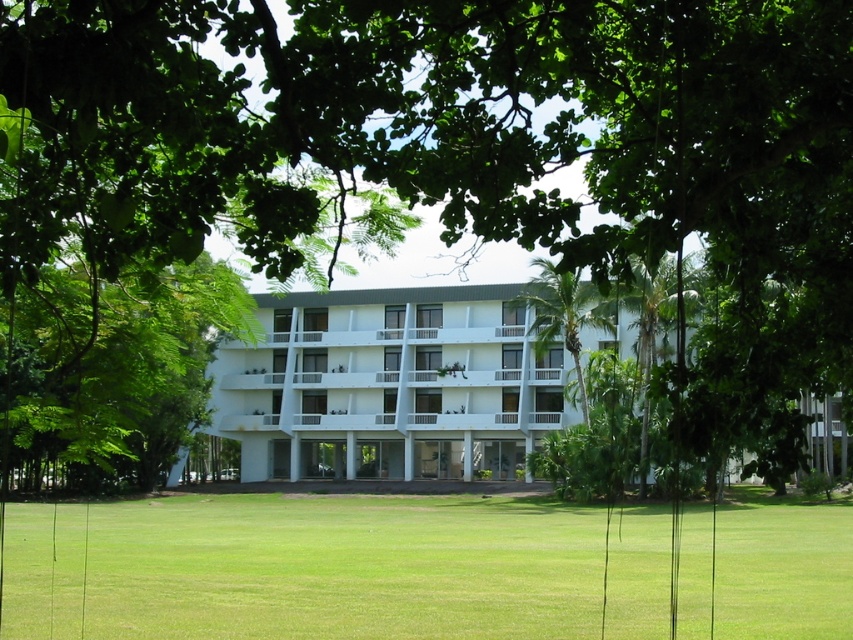
Can you confirm if green leafy tree at center is thinner than green leafy palm tree at center?

No, green leafy tree at center is not thinner than green leafy palm tree at center.

Is green leafy tree at center to the left of green leafy palm tree at center from the viewer's perspective?

Correct, you'll find green leafy tree at center to the left of green leafy palm tree at center.

Locate an element on the screen. The image size is (853, 640). green leafy tree at center is located at coordinates (109, 371).

Does green grass at center appear under green leafy palm tree at center?

Yes.

Measure the distance between green grass at center and green leafy palm tree at center.

green grass at center and green leafy palm tree at center are 58.38 feet apart from each other.

Is point (817, 611) positioned after point (572, 285)?

That is False.

I want to click on green grass at center, so click(303, 566).

Which of these two, green grass at center or green leafy tree at center, stands shorter?

green grass at center is shorter.

Is point (469, 584) positioned after point (178, 344)?

Yes, point (469, 584) is behind point (178, 344).

At what (x,y) coordinates should I click in order to perform the action: click on green grass at center. Please return your answer as a coordinate pair (x, y). This screenshot has width=853, height=640. Looking at the image, I should click on (303, 566).